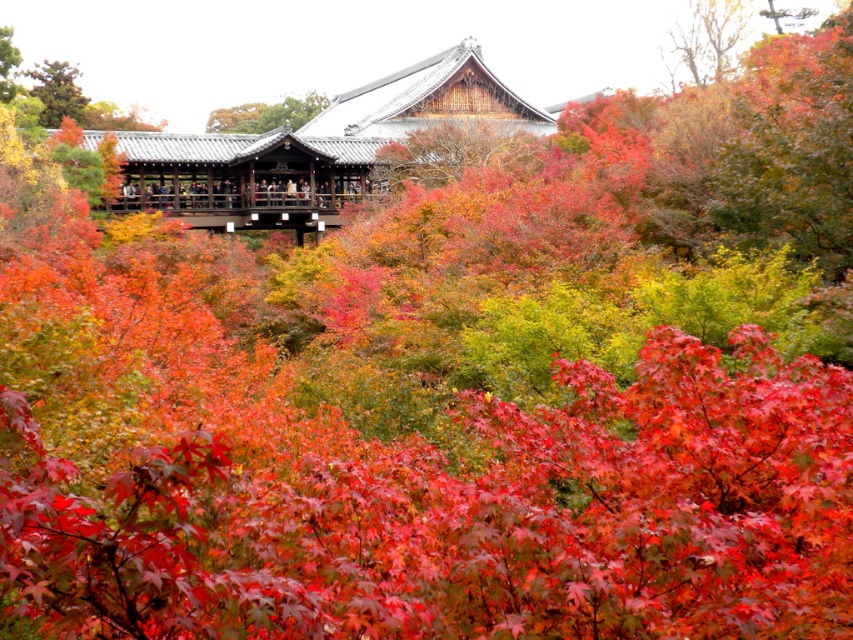
You are a hiker standing in the autumn scene. You notice two trees in the distance. One is the smooth bark tree at center and the other is the smooth brown tree trunk at upper center. Which tree is closer to you?

The smooth bark tree at center is closer to you because it is in front of the smooth brown tree trunk at upper center.

You are standing in the autumn scene described. There is a smooth bark tree at center located at point (445, 150). If you walk straight ahead, will you encounter this tree before reaching the midground or after passing the midground?

The smooth bark tree at center is located at point (445, 150). Since the midground is between the foreground and background, and the tree is at the center point, you would encounter it after passing the midground.

You are an artist sketching this autumn scene. You want to draw the smooth bark tree at upper right and the smooth brown tree trunk at upper center. Which tree should you draw first to maintain the correct spatial relationship?

You should draw the smooth brown tree trunk at upper center first because the smooth bark tree at upper right is positioned under it, meaning the trunk is closer to the viewer and should be sketched before the tree beneath it.